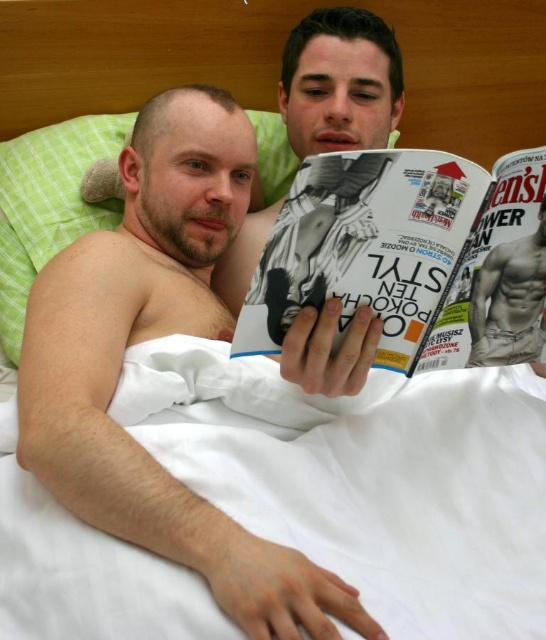
Can you confirm if smooth skin man at left is bigger than green fabric pillow at upper left?

Indeed, smooth skin man at left has a larger size compared to green fabric pillow at upper left.

Is smooth skin man at left smaller than green fabric pillow at upper left?

No, smooth skin man at left is not smaller than green fabric pillow at upper left.

Where is `smooth skin man at left`? smooth skin man at left is located at coordinates (156, 337).

Between smooth skin man at left and muscular skin torso at center, which one is positioned lower?

smooth skin man at left is lower down.

Which is in front, point (158, 205) or point (536, 276)?

Point (536, 276) is in front.

I want to click on smooth skin man at left, so click(156, 337).

Can you confirm if smooth skin man at left is positioned above white glossy magazine at center?

Actually, smooth skin man at left is below white glossy magazine at center.

Which is more to the right, smooth skin man at left or white glossy magazine at center?

Positioned to the right is white glossy magazine at center.

The height and width of the screenshot is (640, 546). I want to click on smooth skin man at left, so [x=156, y=337].